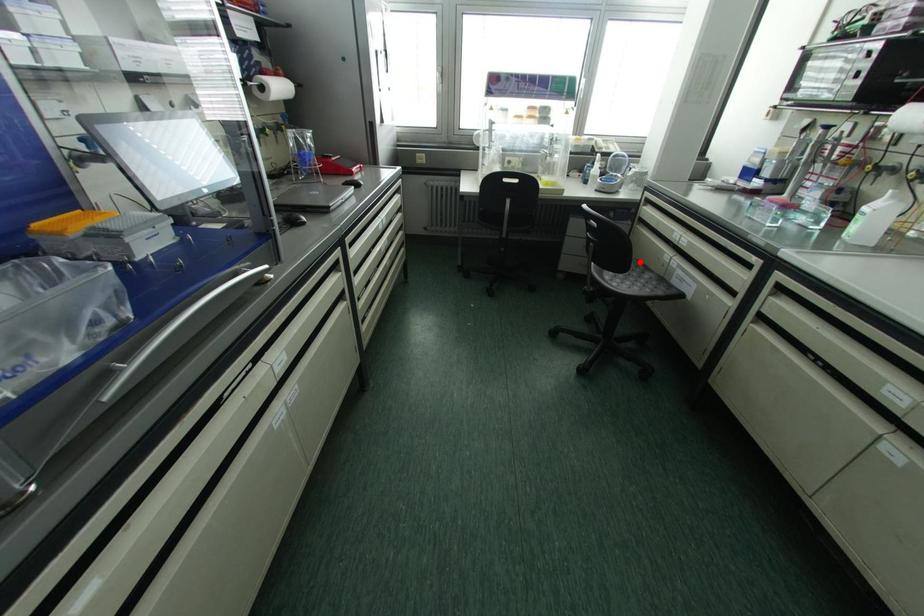
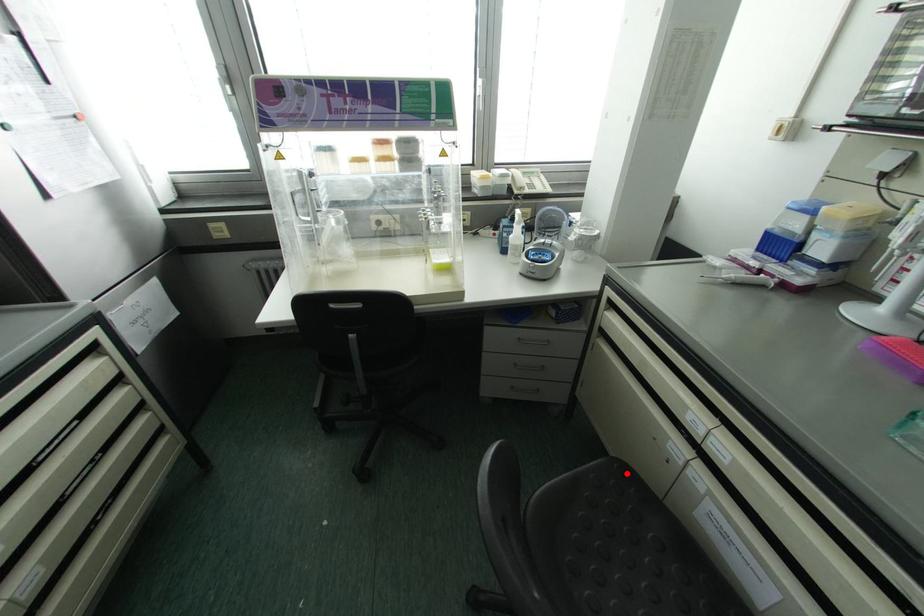
I am providing you with two images of the same scene from different viewpoints. A red point is marked on the first image and another point is marked on the second image. Does the point marked in image1 correspond to the same location as the one in image2?

Yes